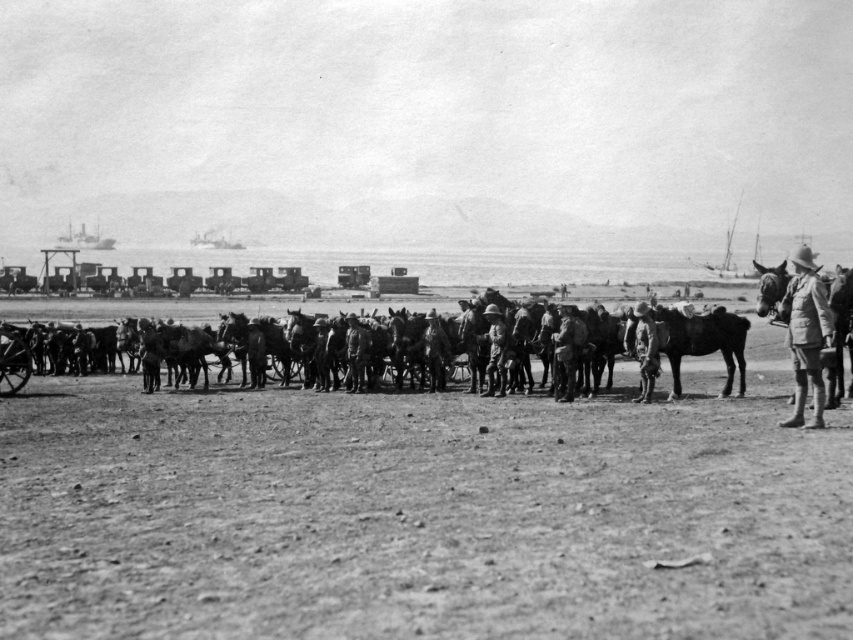
You are a military strategist observing the formation of soldiers in the scene. You notice two soldiers at the center wearing khaki uniform at center and camouflage fabric uniform at center. Which soldier has a wider uniform?

The khaki uniform at center might be wider than camouflage fabric uniform at center, so the soldier wearing the khaki uniform at center has a wider uniform.

You are a military officer observing the soldiers in the historical military scene. You need to determine which soldier is more prominent in the formation. Which soldier wears the khaki uniform at center or the camouflage fabric uniform at center?

The khaki uniform at center is bigger than the camouflage fabric uniform at center, so the soldier wearing the khaki uniform at center is more prominent in the formation.